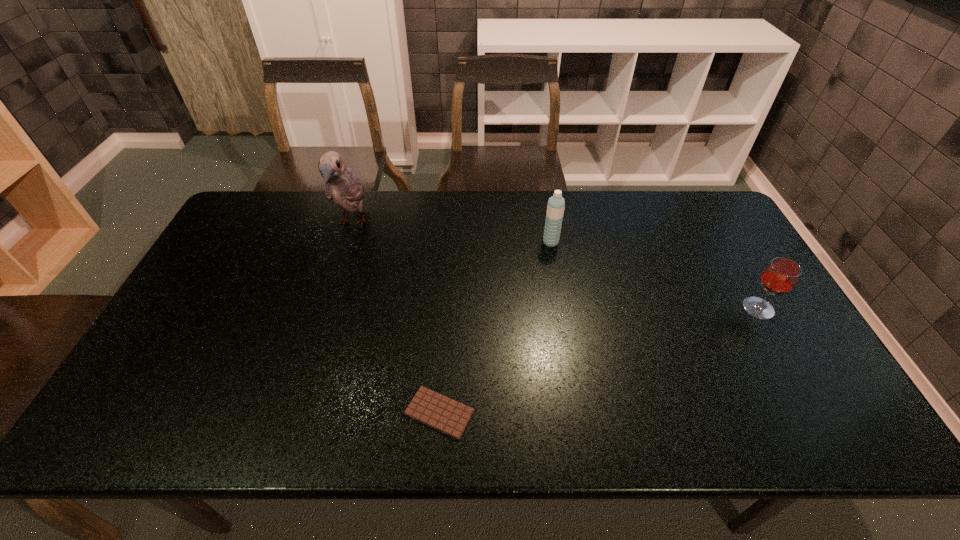
Image resolution: width=960 pixels, height=540 pixels. I want to click on free space between the shortest object and the second shortest object, so click(599, 360).

What are the coordinates of `free area in between the parrot and the shortest object` in the screenshot? It's located at (396, 318).

The image size is (960, 540). I want to click on free space that is in between the parrot and the third object from right to left, so click(x=396, y=318).

In order to click on vacant space in between the third farthest object and the parrot in this screenshot , I will do `click(556, 266)`.

This screenshot has height=540, width=960. What are the coordinates of `empty space that is in between the third tallest object and the parrot` in the screenshot? It's located at (556, 266).

Where is `free spot between the parrot and the shortest object`? The width and height of the screenshot is (960, 540). free spot between the parrot and the shortest object is located at coordinates (396, 318).

Identify the location of unoccupied position between the shortest object and the water bottle. (495, 327).

Find the location of `vacant area that lies between the parrot and the nearest object`. vacant area that lies between the parrot and the nearest object is located at coordinates (396, 318).

At what (x,y) coordinates should I click in order to perform the action: click on vacant area between the leftmost object and the wineglass. Please return your answer as a coordinate pair (x, y). Looking at the image, I should click on (556, 266).

Identify which object is the third nearest to the parrot. Please provide its 2D coordinates. Your answer should be formatted as a tuple, i.e. [(x, y)], where the tuple contains the x and y coordinates of a point satisfying the conditions above.

[(781, 275)]